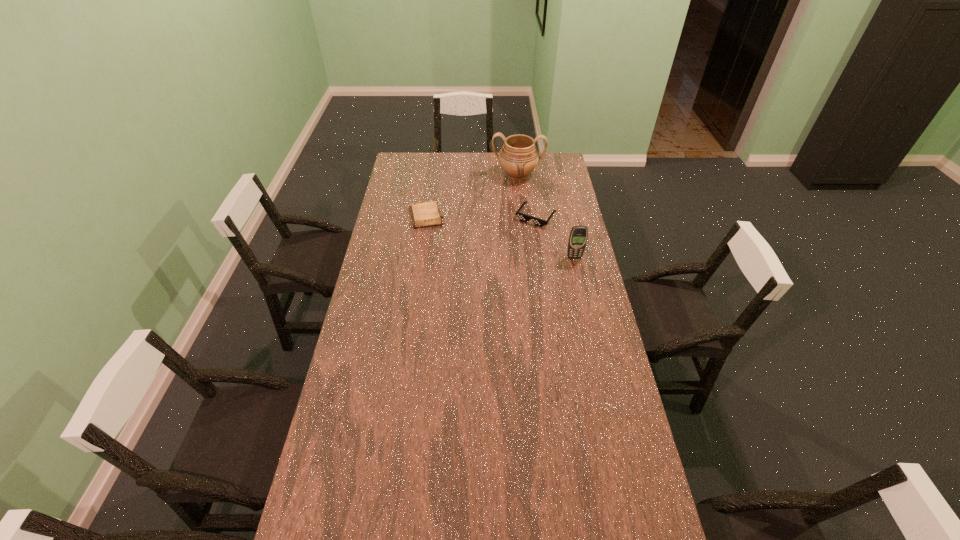
Locate an element on the screen. The height and width of the screenshot is (540, 960). the shortest object is located at coordinates (424, 214).

You are a GUI agent. You are given a task and a screenshot of the screen. Output one action in this format:
    pyautogui.click(x=<x>, y=<y>)
    Task: Click on the diary
    This screenshot has width=960, height=540.
    Given the screenshot: What is the action you would take?
    pyautogui.click(x=424, y=214)

Locate an element on the screen. The height and width of the screenshot is (540, 960). the rightmost object is located at coordinates (578, 236).

Locate an element on the screen. the nearest object is located at coordinates (578, 236).

The image size is (960, 540). I want to click on the tallest object, so click(518, 157).

You are a GUI agent. You are given a task and a screenshot of the screen. Output one action in this format:
    pyautogui.click(x=<x>, y=<y>)
    Task: Click on the urn
    This screenshot has height=540, width=960.
    Given the screenshot: What is the action you would take?
    pyautogui.click(x=518, y=157)

Where is `sunglasses`? This screenshot has width=960, height=540. sunglasses is located at coordinates (523, 217).

The height and width of the screenshot is (540, 960). I want to click on vacant region located on the back of the diary, so (433, 166).

The image size is (960, 540). Identify the location of free spot located on the screen of the nearest object. (587, 315).

This screenshot has height=540, width=960. Find the location of `free location located on the front-facing side of the urn`. free location located on the front-facing side of the urn is located at coordinates pos(515,199).